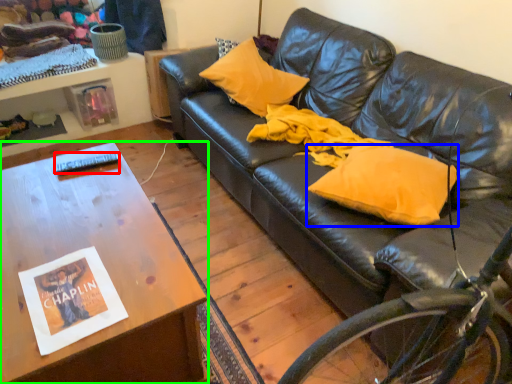
Question: Estimate the real-world distances between objects in this image. Which object is farther from remote control (highlighted by a red box), pillow (highlighted by a blue box) or table (highlighted by a green box)?

Choices:
 (A) pillow
 (B) table

Answer: (A)